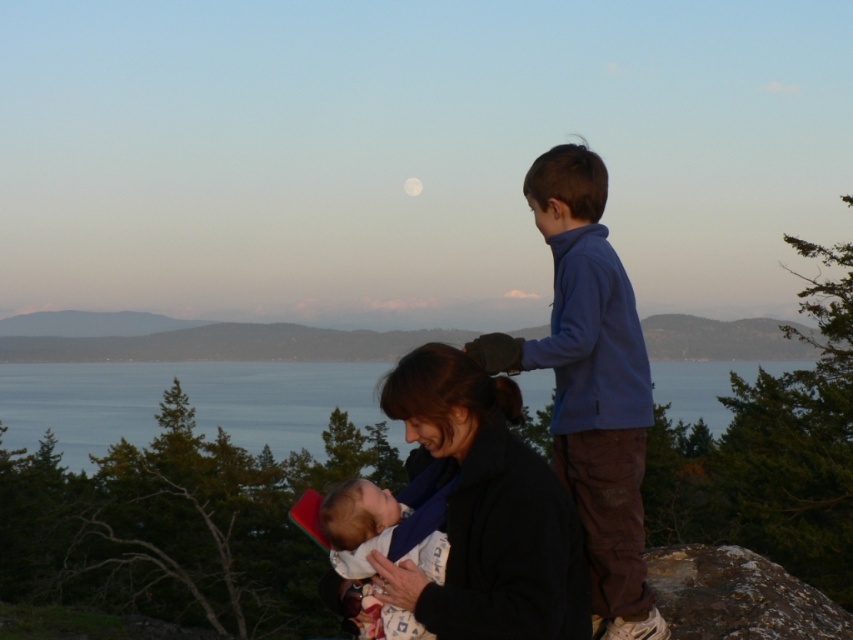
You are standing in the scene and want to place a small flag at each of the two points labeled point [503,628] and point [577,458]. Which point should you place your flag closer to the front of the image?

Point [503,628] is closer to the viewer than point [577,458], so you should place the flag at point [503,628] to have it closer to the front of the image.

You are a fashion designer observing the scene. You need to determine which item, the black soft jacket at center or the soft white fabric at center, would require more fabric in terms of vertical space when creating a pattern. Based on their positions in the image, which one would need more fabric vertically?

The black soft jacket at center has a greater height compared to the soft white fabric at center, so it would require more fabric vertically when creating a pattern.

You are a fashion designer observing the image and want to create a new outfit that combines elements from both the black soft jacket at center and the soft white fabric at center. Considering their widths, which item should you use as the base for the main body of the outfit to ensure it accommodates the other without looking cramped?

The black soft jacket at center should be used as the base for the main body since its width surpasses that of the soft white fabric at center, providing enough space to incorporate the narrower fabric without causing a cramped appearance.